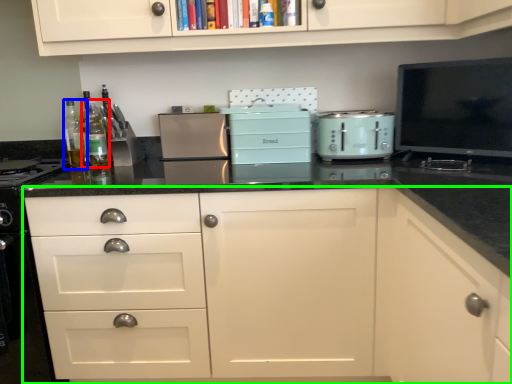
Question: Considering the real-world distances, which object is closest to bottle (highlighted by a red box)? bottle (highlighted by a blue box) or cabinetry (highlighted by a green box).

Choices:
 (A) bottle
 (B) cabinetry

Answer: (A)